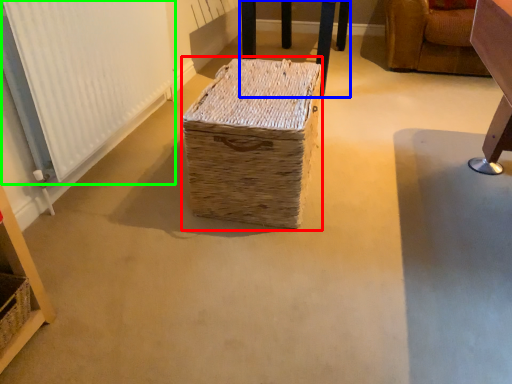
Question: Considering the real-world distances, which object is closest to storage box (highlighted by a red box)? furniture (highlighted by a blue box) or radiator (highlighted by a green box).

Choices:
 (A) furniture
 (B) radiator

Answer: (B)